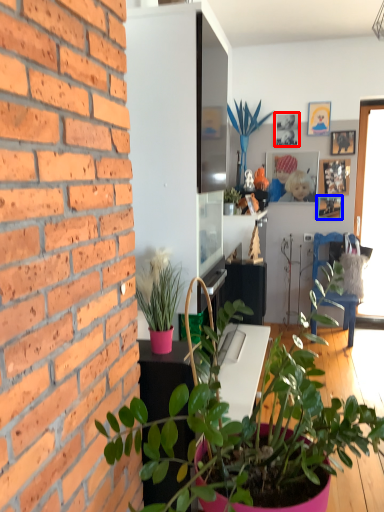
Question: Which point is closer to the camera, picture frame (highlighted by a red box) or picture frame (highlighted by a blue box)?

Choices:
 (A) picture frame
 (B) picture frame

Answer: (A)